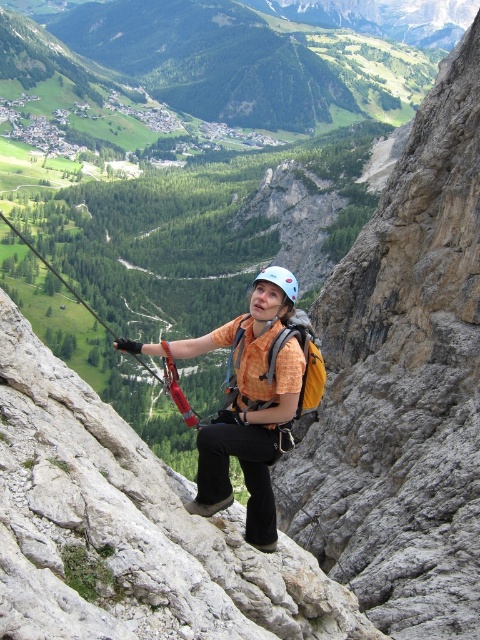
Question: Observing the image, what is the correct spatial positioning of orange fabric shirt at center in reference to light blue matte helmet at center?

Choices:
 (A) below
 (B) above

Answer: (A)

Question: Does orange fabric shirt at center appear on the left side of red nylon rope at center?

Choices:
 (A) no
 (B) yes

Answer: (A)

Question: Does orange fabric shirt at center appear on the right side of light blue matte helmet at center?

Choices:
 (A) no
 (B) yes

Answer: (A)

Question: Which point appears closest to the camera in this image?

Choices:
 (A) (173, 387)
 (B) (269, 344)
 (C) (274, 268)

Answer: (B)

Question: Which point appears farthest from the camera in this image?

Choices:
 (A) (212, 468)
 (B) (16, 234)
 (C) (268, 275)

Answer: (B)

Question: Which point appears closest to the camera in this image?

Choices:
 (A) (210, 449)
 (B) (297, 288)
 (C) (187, 420)

Answer: (A)